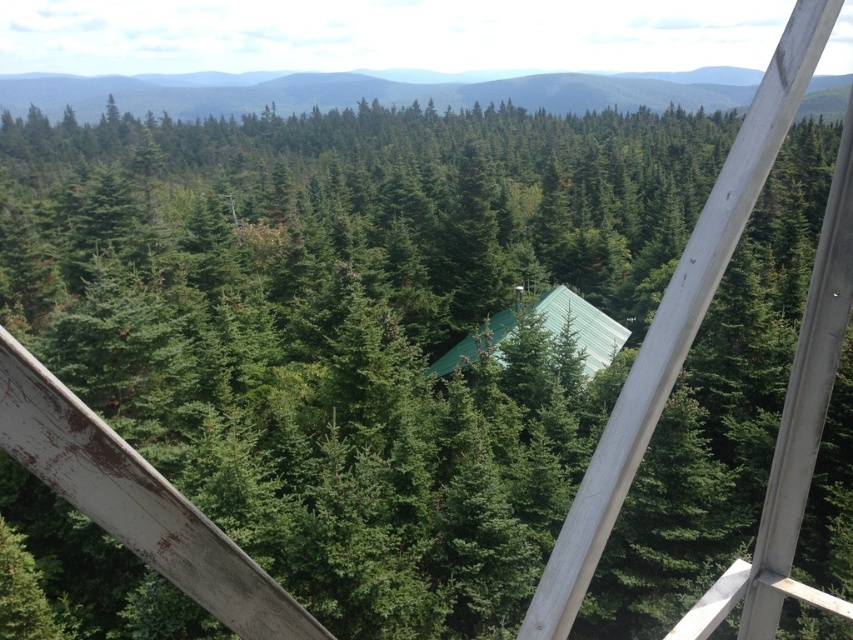
You are standing on a metal platform and see the green matte forest at upper center and the green metal cabin at center. Which object is located higher in the scene?

The green matte forest at upper center is positioned over the green metal cabin at center, so it is higher in the scene.

You are standing at the top of a forest observation tower and looking out at the scene. There is a point marked at coordinates (372, 92). What is located at that point?

At point (372, 92) lies green matte forest at upper center.